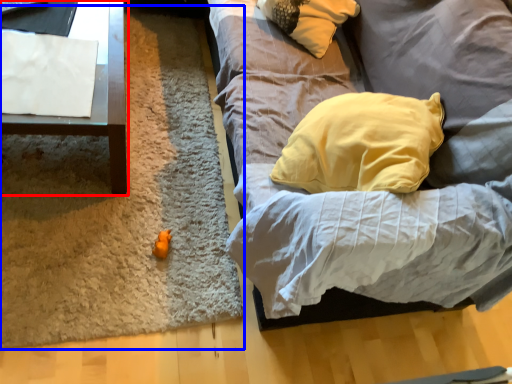
Question: Which object appears farthest to the camera in this image, furniture (highlighted by a red box) or mat (highlighted by a blue box)?

Choices:
 (A) furniture
 (B) mat

Answer: (B)